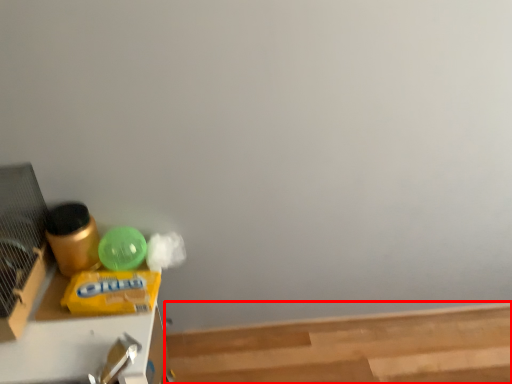
Question: Considering the relative positions of wood (annotated by the red box) and furniture in the image provided, where is wood (annotated by the red box) located with respect to the staircase?

Choices:
 (A) left
 (B) right

Answer: (B)